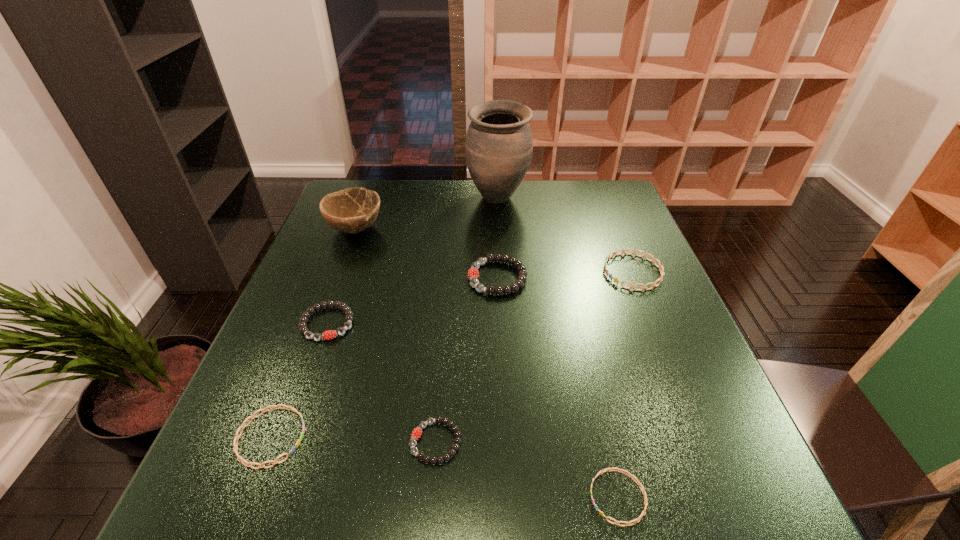
Identify the location of free spot between the second smallest blue bracelet and the biggest blue bracelet. [452, 355].

Find the location of `free space between the nearest black bracelet and the rightmost black bracelet`. free space between the nearest black bracelet and the rightmost black bracelet is located at coordinates (467, 360).

At what (x,y) coordinates should I click in order to perform the action: click on empty space that is in between the fifth bracelet from left to right and the rightmost black bracelet. Please return your answer as a coordinate pair (x, y). Image resolution: width=960 pixels, height=540 pixels. Looking at the image, I should click on (558, 388).

This screenshot has width=960, height=540. Identify the location of free space that is in between the second black bracelet from right to left and the second tallest object. (396, 335).

Identify the location of free spot between the rightmost black bracelet and the urn. (497, 238).

The width and height of the screenshot is (960, 540). In order to click on vacant area that lies between the fourth bracelet from left to right and the smallest black bracelet in this screenshot , I will do `click(467, 360)`.

In order to click on the fourth closest object relative to the second black bracelet from right to left in this screenshot , I will do `click(473, 273)`.

Image resolution: width=960 pixels, height=540 pixels. I want to click on object that stands as the second closest to the second black bracelet from left to right, so click(x=640, y=517).

Select which bracelet is the fourth closest to the tallest object. Please provide its 2D coordinates. Your answer should be formatted as a tuple, i.e. [(x, y)], where the tuple contains the x and y coordinates of a point satisfying the conditions above.

[(417, 432)]

I want to click on bracelet identified as the closest to the farthest blue bracelet, so point(473,273).